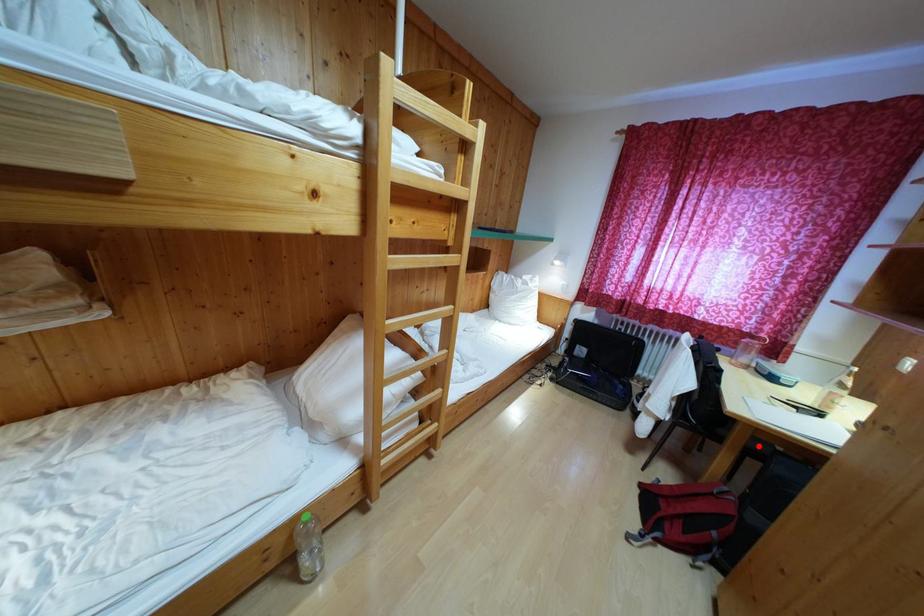
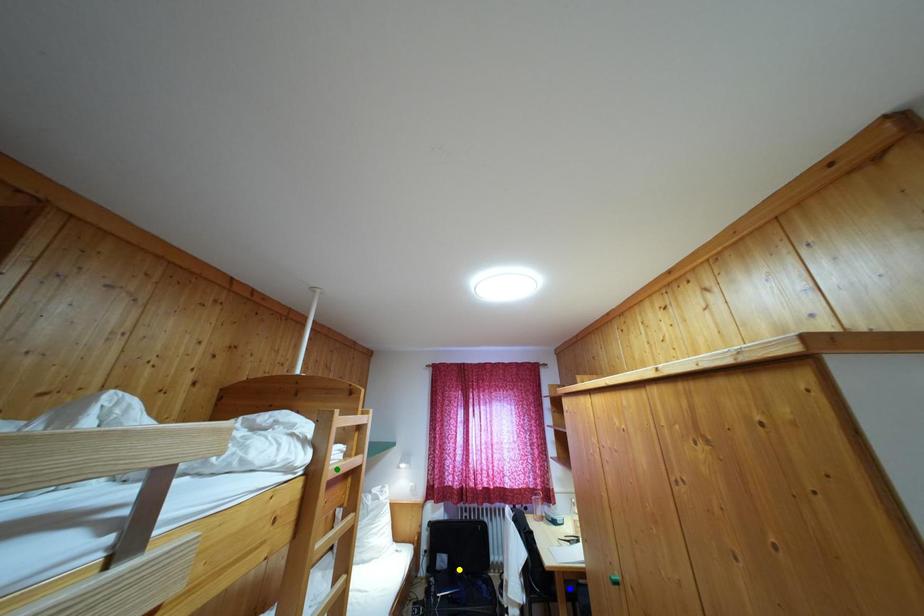
Question: I am providing you with two images of the same scene from different viewpoints. A red point is marked on the first image. You are given multiple points on the second image. In image 2, which mark is for the same physical point as the one in image 1?

Choices:
 (A) green point
 (B) blue point
 (C) yellow point

Answer: (B)